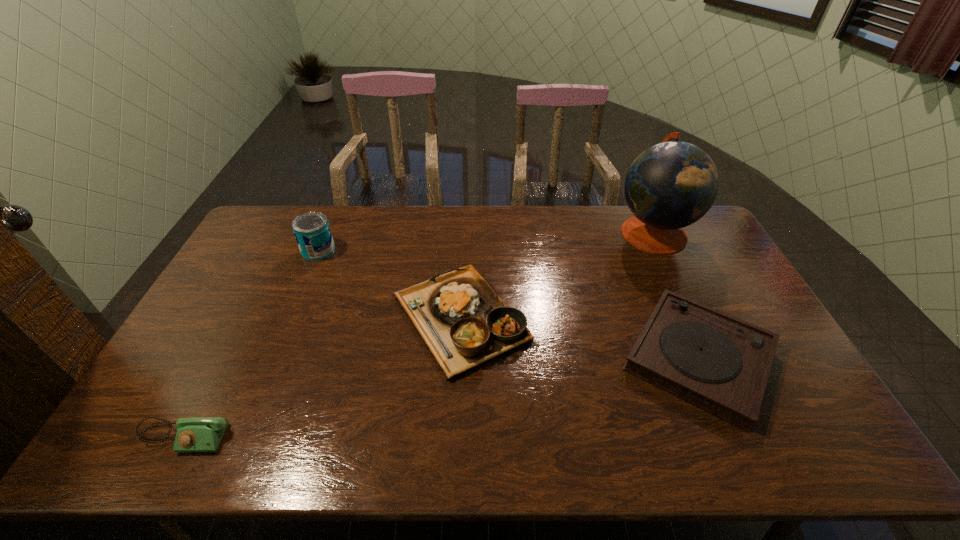
You are a GUI agent. You are given a task and a screenshot of the screen. Output one action in this format:
    pyautogui.click(x=<x>, y=<y>)
    Task: Click on the free space that satisfies the following two spatial constraints: 1. with the Americas facing the viewer on the tallest object; 2. on the front side of the phonograph record
    This screenshot has height=540, width=960.
    Given the screenshot: What is the action you would take?
    pyautogui.click(x=712, y=358)

The width and height of the screenshot is (960, 540). Find the location of `vacant space that satisfies the following two spatial constraints: 1. with the Americas facing the viewer on the globe; 2. on the front side of the phonograph record`. vacant space that satisfies the following two spatial constraints: 1. with the Americas facing the viewer on the globe; 2. on the front side of the phonograph record is located at coordinates (712, 358).

I want to click on vacant region that satisfies the following two spatial constraints: 1. with the Americas facing the viewer on the globe; 2. on the dial of the telephone, so click(749, 437).